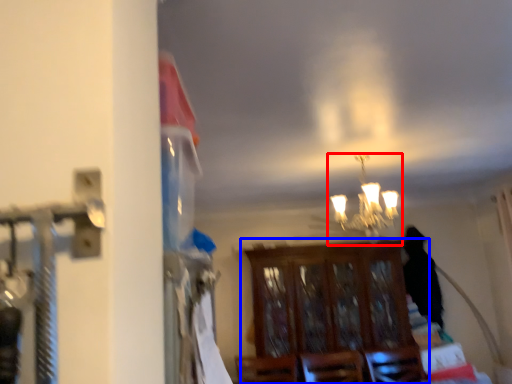
Question: Which object is further to the camera taking this photo, lamp (highlighted by a red box) or furniture (highlighted by a blue box)?

Choices:
 (A) lamp
 (B) furniture

Answer: (B)